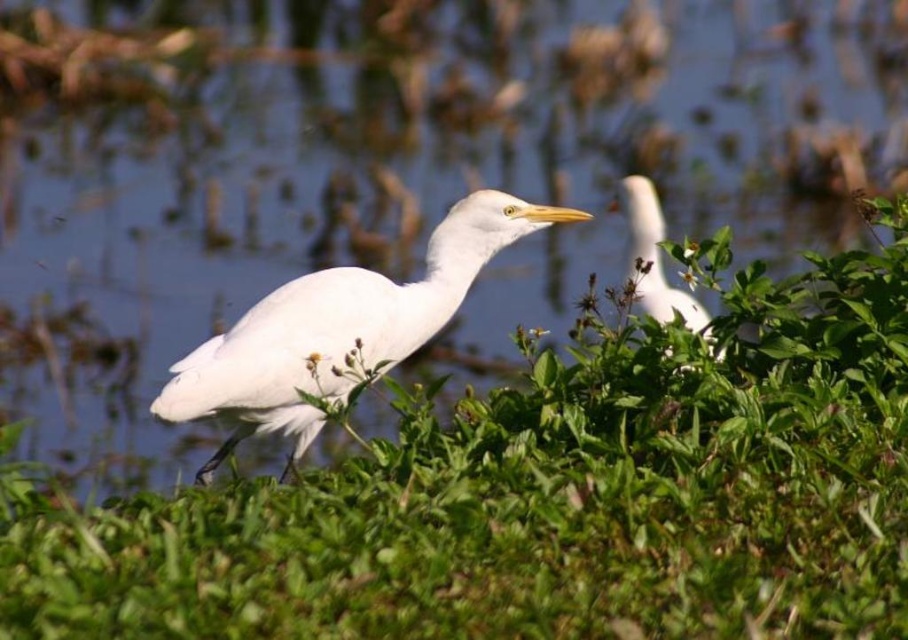
Question: Does green leafy plant at center appear under white smooth bird at upper right?

Choices:
 (A) yes
 (B) no

Answer: (A)

Question: Is white matte bird at center closer to the viewer compared to white smooth bird at upper right?

Choices:
 (A) no
 (B) yes

Answer: (B)

Question: Estimate the real-world distances between objects in this image. Which object is farther from the white matte bird at center?

Choices:
 (A) green leafy plant at center
 (B) white smooth bird at upper right

Answer: (B)

Question: Considering the relative positions of green leafy plant at center and white matte bird at center in the image provided, where is green leafy plant at center located with respect to white matte bird at center?

Choices:
 (A) below
 (B) above

Answer: (A)

Question: Which point is closer to the camera?

Choices:
 (A) (653, 208)
 (B) (367, 308)

Answer: (B)

Question: Which point is closer to the camera taking this photo?

Choices:
 (A) (634, 257)
 (B) (275, 316)
 (C) (880, 611)

Answer: (C)